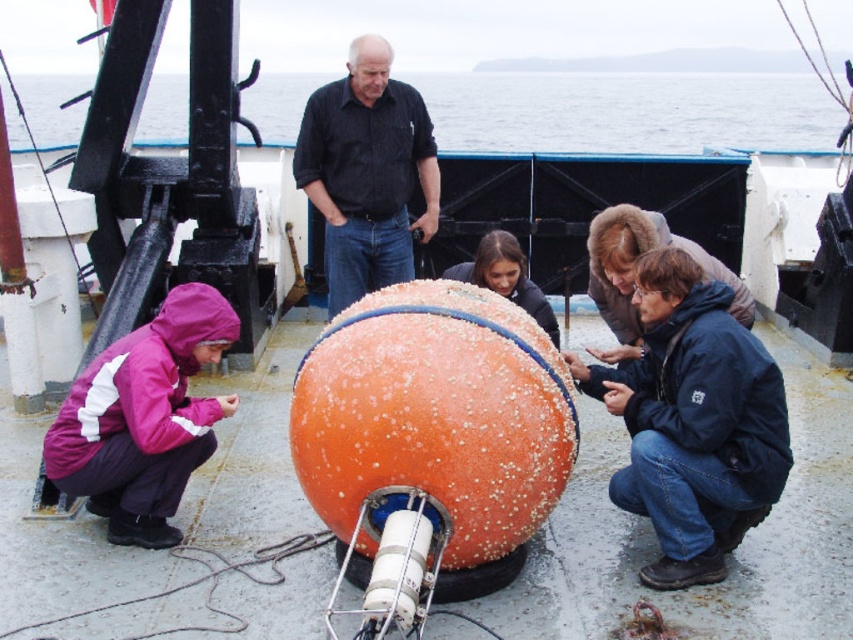
Consider the image. You are a marine biologist observing the buoys on the boat deck. You need to attach a new sensor to the orange rubber buoy at center. Which direction should you move from the orange matte buoy at lower center to reach it?

The orange matte buoy at lower center is to the right of the orange rubber buoy at center, so you should move to the left to reach the orange rubber buoy at center.